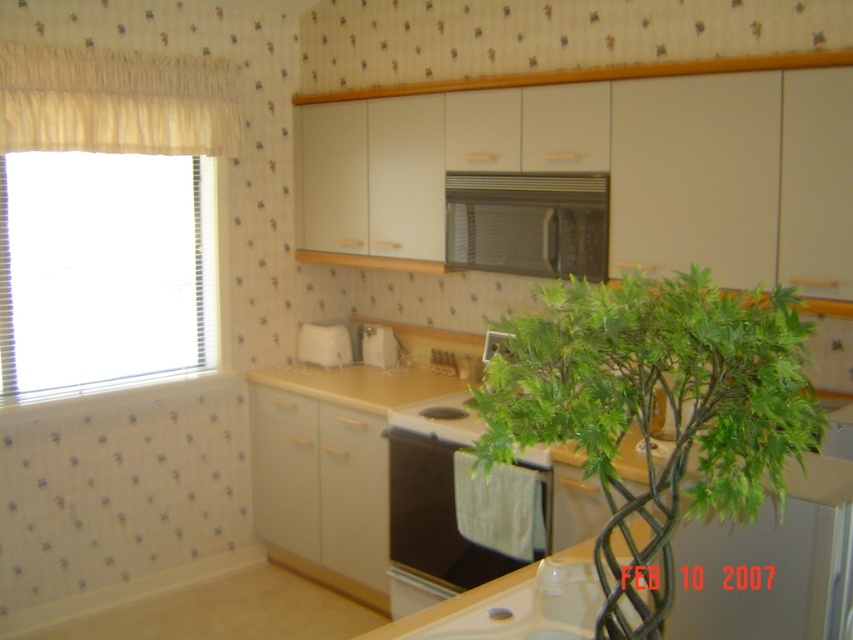
Question: Does black matte oven at center come in front of white glossy sink at lower center?

Choices:
 (A) yes
 (B) no

Answer: (B)

Question: Can you confirm if transparent glass window at left is positioned to the left of black matte microwave at upper center?

Choices:
 (A) no
 (B) yes

Answer: (B)

Question: Which point is closer to the camera?

Choices:
 (A) white plastic toaster at center
 (B) black matte oven at center

Answer: (B)

Question: Which of these objects is positioned closest to the transparent glass window at left?

Choices:
 (A) beige fabric curtain at upper left
 (B) satin silver toaster at center
 (C) black matte oven at center

Answer: (A)

Question: Is black matte oven at center positioned before white glossy sink at lower center?

Choices:
 (A) no
 (B) yes

Answer: (A)

Question: Which of the following is the closest to the observer?

Choices:
 (A) (483, 352)
 (B) (332, 352)

Answer: (A)